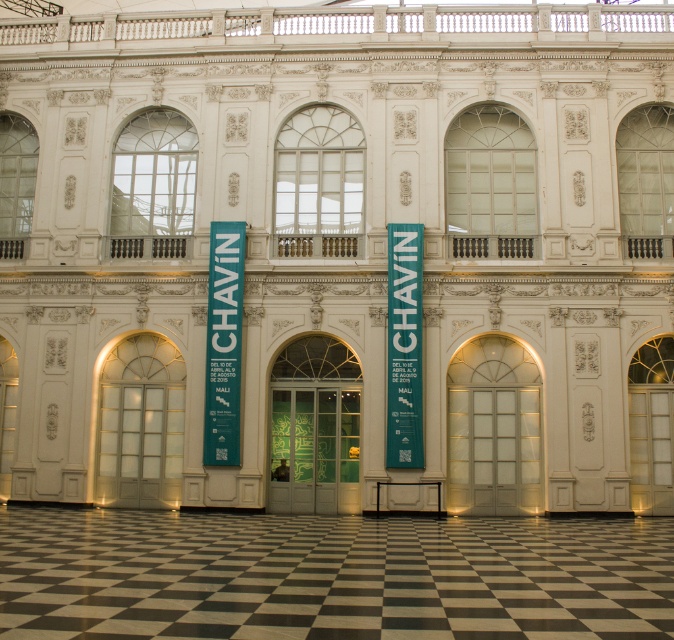
Question: Does teal fabric banner at center come behind green fabric banner at center?

Choices:
 (A) no
 (B) yes

Answer: (B)

Question: Based on their relative distances, which object is farther from the teal fabric banner at center?

Choices:
 (A) green fabric banner at center
 (B) black checkered floor at center

Answer: (B)

Question: Which point is closer to the camera taking this photo?

Choices:
 (A) (412, 269)
 (B) (501, 563)

Answer: (B)

Question: Does black checkered floor at center have a lesser width compared to green fabric banner at center?

Choices:
 (A) yes
 (B) no

Answer: (B)

Question: Among these points, which one is nearest to the camera?

Choices:
 (A) (650, 529)
 (B) (388, 448)

Answer: (A)

Question: Does teal fabric banner at center have a larger size compared to green fabric banner at center?

Choices:
 (A) no
 (B) yes

Answer: (B)